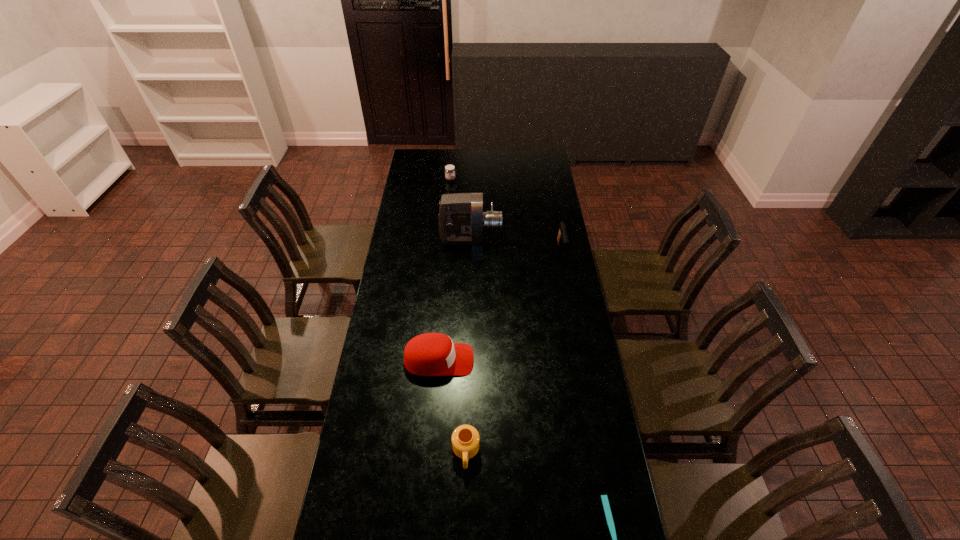
At what (x,y) coordinates should I click in order to perform the action: click on the tallest object. Please return your answer as a coordinate pair (x, y). Looking at the image, I should click on (461, 218).

The image size is (960, 540). What are the coordinates of `pistol` in the screenshot? It's located at (562, 238).

Locate an element on the screen. the third nearest object is located at coordinates (431, 354).

The height and width of the screenshot is (540, 960). What are the coordinates of `baseball cap` in the screenshot? It's located at (431, 354).

Find the location of `the second nearest object`. the second nearest object is located at coordinates (465, 439).

Locate an element on the screen. This screenshot has height=540, width=960. the farthest object is located at coordinates (449, 169).

This screenshot has height=540, width=960. Find the location of `free location located 0.270m at the front of the camcorder, highlighting the lens`. free location located 0.270m at the front of the camcorder, highlighting the lens is located at coordinates (557, 239).

Locate an element on the screen. vacant area situated at the barrel of the pistol is located at coordinates (567, 283).

Find the location of a particular element. free spot located 0.200m on the front-facing side of the baseball cap is located at coordinates (526, 360).

The image size is (960, 540). In order to click on free space located 0.160m on the handle side of the second nearest object in this screenshot , I will do `click(465, 529)`.